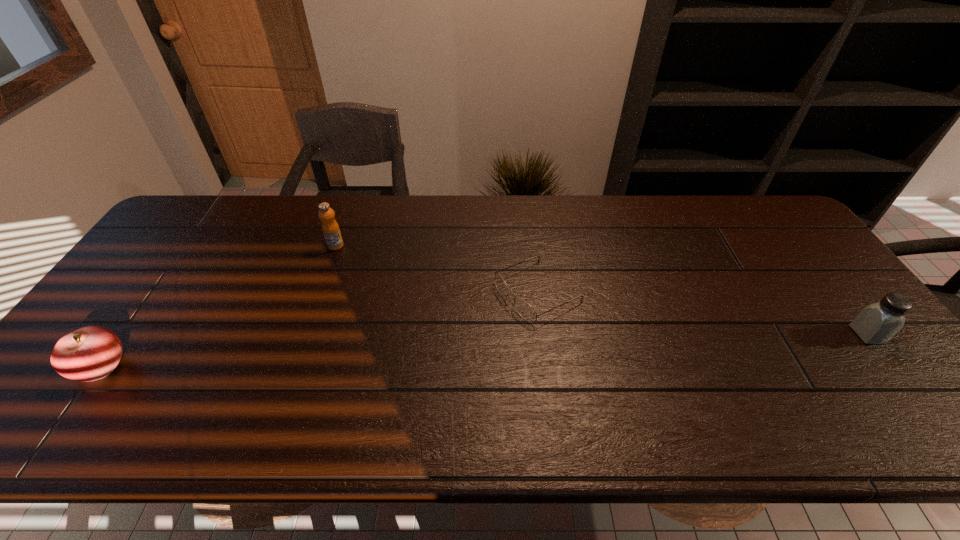
Locate an element on the screen. apple is located at coordinates (90, 353).

Find the location of a particular element. The height and width of the screenshot is (540, 960). saltshaker is located at coordinates (877, 323).

Where is `spectacles`? The image size is (960, 540). spectacles is located at coordinates (526, 311).

Identify the location of the shortest object. The height and width of the screenshot is (540, 960). (526, 311).

Find the location of a particular element. The width and height of the screenshot is (960, 540). orange juice is located at coordinates (330, 228).

Identify the location of the second object from left to right. (330, 228).

Identify the location of vacant point located 0.070m on the right of the leftmost object. (156, 366).

Image resolution: width=960 pixels, height=540 pixels. Find the location of `vacant space located on the front of the saltshaker`. vacant space located on the front of the saltshaker is located at coordinates (900, 376).

This screenshot has width=960, height=540. I want to click on free space located on the front-facing side of the spectacles, so click(x=400, y=361).

Where is `free space located 0.230m on the front-facing side of the spectacles`? The width and height of the screenshot is (960, 540). free space located 0.230m on the front-facing side of the spectacles is located at coordinates (426, 348).